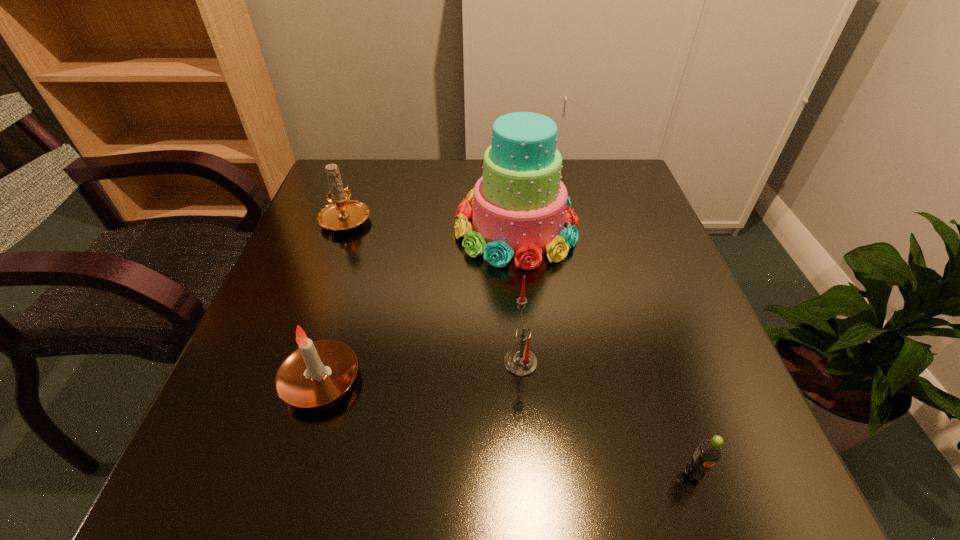
Where is `cake`? cake is located at coordinates (520, 206).

Locate an element on the screen. The image size is (960, 540). the farthest candle is located at coordinates point(343,214).

Image resolution: width=960 pixels, height=540 pixels. In order to click on the rightmost candle in this screenshot , I will do `click(521, 361)`.

Where is `the rightmost object`? This screenshot has width=960, height=540. the rightmost object is located at coordinates (709, 451).

Where is `the nearest object`? This screenshot has height=540, width=960. the nearest object is located at coordinates (709, 451).

Find the location of a particular element. This screenshot has height=540, width=960. vacant position located on the front of the cake is located at coordinates (535, 429).

The width and height of the screenshot is (960, 540). Find the location of `vacant position located 0.290m on the front of the farthest candle`. vacant position located 0.290m on the front of the farthest candle is located at coordinates (303, 335).

The height and width of the screenshot is (540, 960). Identify the location of free location located 0.110m on the front-facing side of the rightmost candle. (442, 362).

Locate an element on the screen. vacant space located on the front-facing side of the rightmost candle is located at coordinates (373, 362).

At what (x,y) coordinates should I click in order to perform the action: click on free space located on the front-facing side of the rightmost candle. Please return your answer as a coordinate pair (x, y). Looking at the image, I should click on (356, 362).